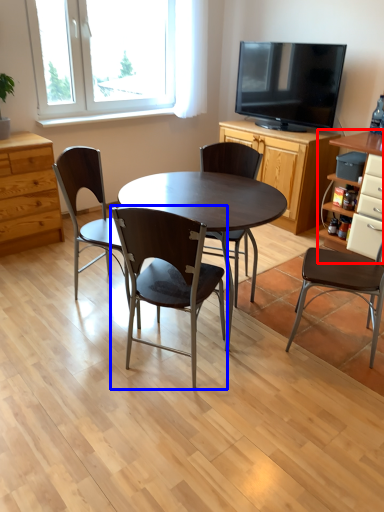
Question: Which of the following is the farthest to the observer, cabinetry (highlighted by a red box) or chair (highlighted by a blue box)?

Choices:
 (A) cabinetry
 (B) chair

Answer: (A)